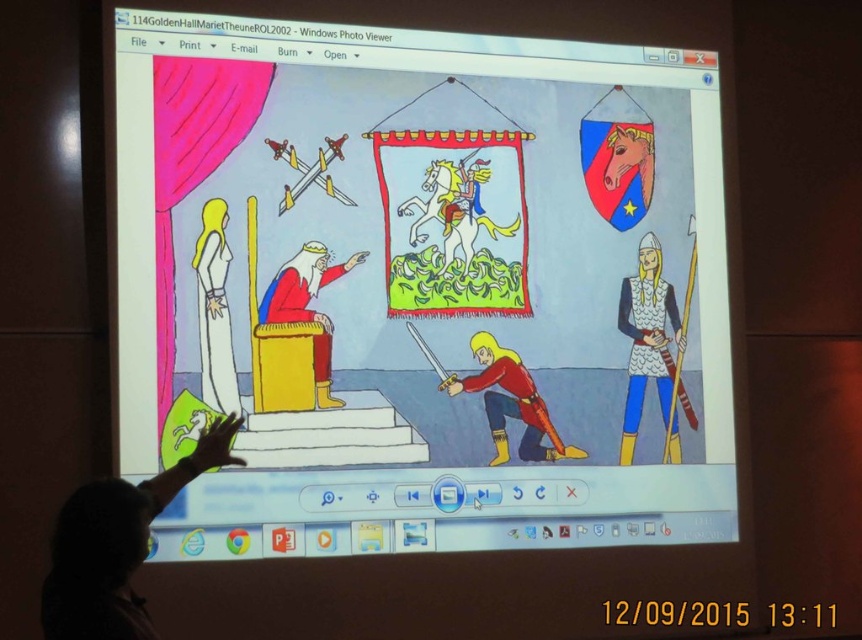
Question: Which point is closer to the camera?

Choices:
 (A) white glossy dress at upper left
 (B) shiny red armor at lower center
 (C) matte red fabric throne at center

Answer: (A)

Question: Can you confirm if metallic chainmail armor at right is positioned to the right of white glossy dress at upper left?

Choices:
 (A) yes
 (B) no

Answer: (A)

Question: Which point is farther to the camera?

Choices:
 (A) (261, 29)
 (B) (461, 380)

Answer: (B)

Question: Is smooth skin hand at lower left positioned at the back of shiny red armor at lower center?

Choices:
 (A) yes
 (B) no

Answer: (B)

Question: Which point is farther from the camera taking this photo?

Choices:
 (A) (667, 428)
 (B) (561, 456)
 (C) (664, 108)

Answer: (C)

Question: Can you confirm if matte paper banner at upper center is wider than metallic chainmail armor at right?

Choices:
 (A) no
 (B) yes

Answer: (B)